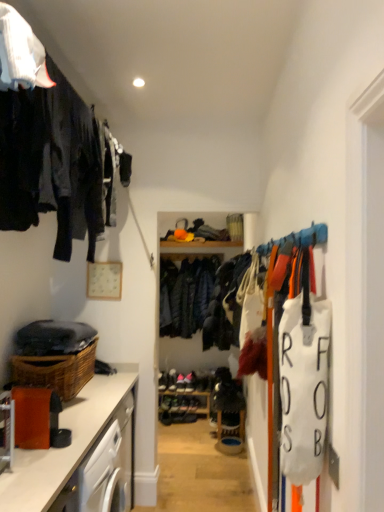
Question: Considering the positions of dark blue woolen jacket at center and shiny black shoe at center, which is the 2th shoe in bottom-to-top order, in the image, is dark blue woolen jacket at center wider or thinner than shiny black shoe at center, which is the 2th shoe in bottom-to-top order,?

Choices:
 (A) wide
 (B) thin

Answer: (A)

Question: Considering the positions of dark blue woolen jacket at center and shiny black shoe at center, placed as the 3th shoe when sorted from top to bottom, in the image, is dark blue woolen jacket at center bigger or smaller than shiny black shoe at center, placed as the 3th shoe when sorted from top to bottom,?

Choices:
 (A) small
 (B) big

Answer: (B)

Question: Which object is the closest to the wooden shelf at center?

Choices:
 (A) leather shoe at center, placed as the 1th shoe when sorted from top to bottom
 (B) leather shoe at center, arranged as the 4th shoe when viewed from the top
 (C) shiny black shoe at center, which is the 2th shoe in bottom-to-top order
 (D) dark blue woolen jacket at center
 (E) matte brown countertop at lower left

Answer: (B)

Question: Which of these objects is positioned farthest from the matte brown countertop at lower left?

Choices:
 (A) dark blue woolen jacket at center
 (B) leather shoe at center, arranged as the 4th shoe when viewed from the top
 (C) matte black clothing at left
 (D) shiny black shoe at center, placed as the 3th shoe when sorted from top to bottom
 (E) leather shoe at center, the 3th shoe when ordered from bottom to top

Answer: (E)